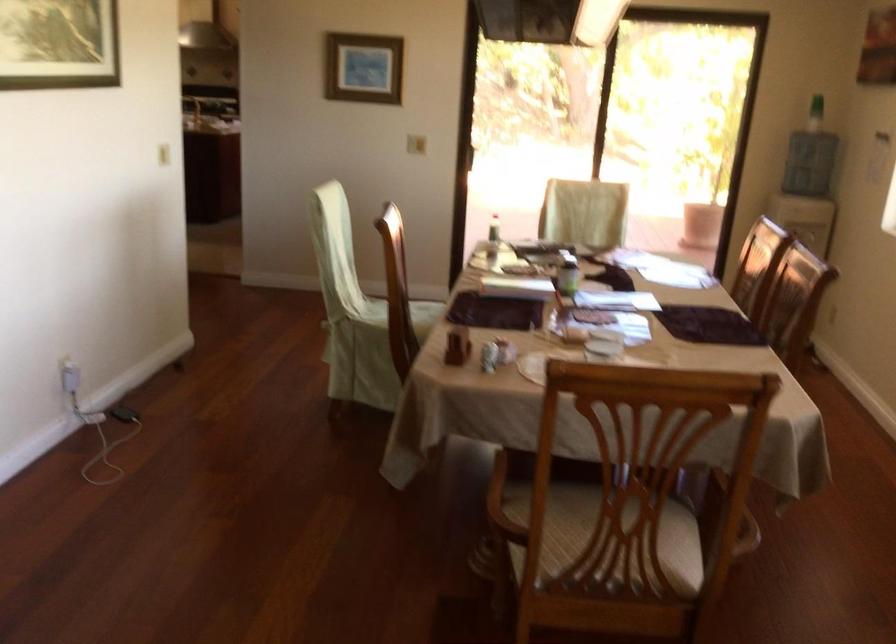
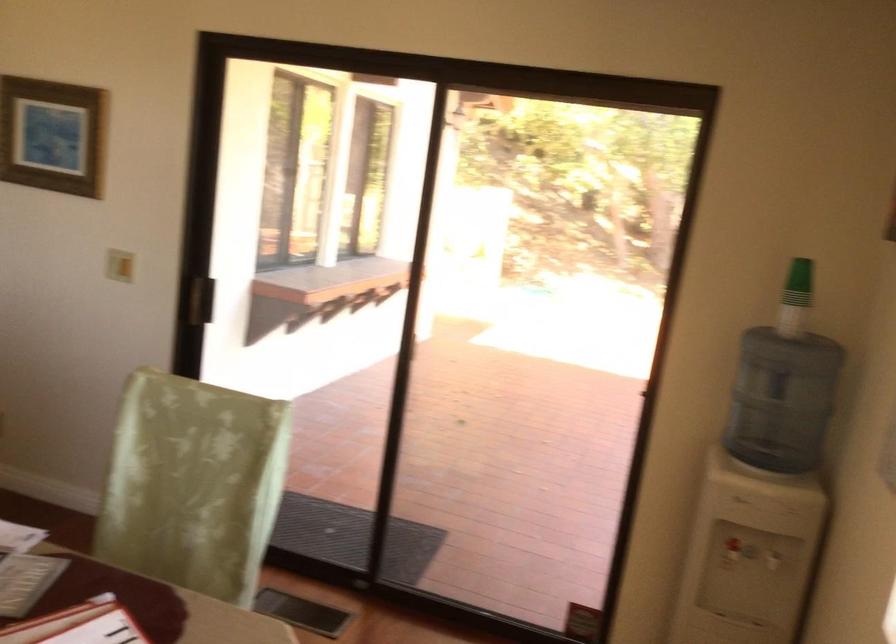
In the second image, find the point that corresponds to point (432, 135) in the first image.

(119, 265)